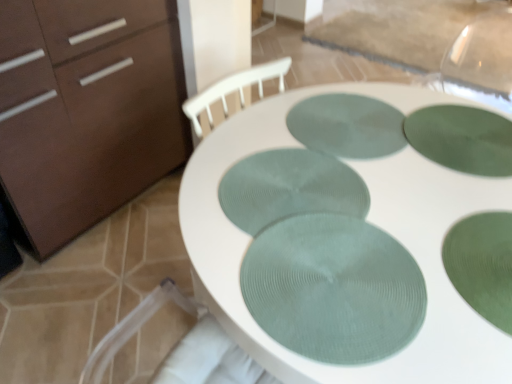
Where is `free space between green textured glass plate at center, the third glass plate when ordered from front to back, and green textured glass plate at center, the first glass plate viewed from the front`? The image size is (512, 384). free space between green textured glass plate at center, the third glass plate when ordered from front to back, and green textured glass plate at center, the first glass plate viewed from the front is located at coordinates (351, 225).